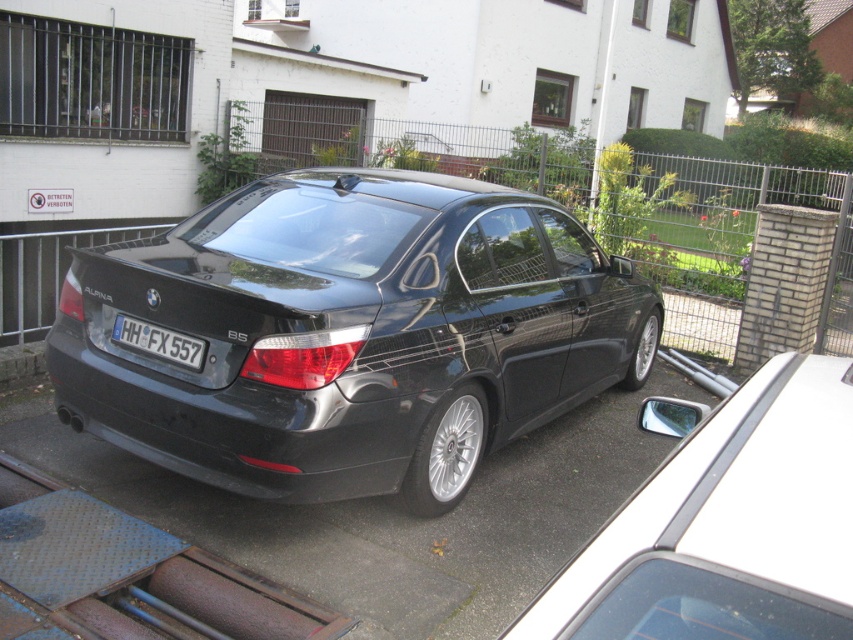
You are a photographer taking a picture of the BMW sedan from the front. You notice two points on the car, one at point (199, 381) and another at point (196, 349). Which point will appear closer to the camera in the photo?

Point (199, 381) is closer to the camera than point (196, 349), so it will appear closer in the photo.

You are a photographer trying to capture a closeup of the white plastic license plate at center while also including the glossy black car at center in the frame. Given their sizes, will you need to adjust your camera to a wider angle to include both?

The glossy black car at center is bigger than the white plastic license plate at center. To include both in the frame, you would need to adjust your camera to a wider angle to accommodate the larger size of the glossy black car at center.

You are a delivery driver trying to park your van in the driveway. The parking spot requires the vehicle to be aligned with the center of the driveway. Based on the image, where should you aim to position your van relative to the black asphalt driveway at center?

You should aim to position your van at the center of the black asphalt driveway at center, which is located at point (387, 515) as specified in the description.